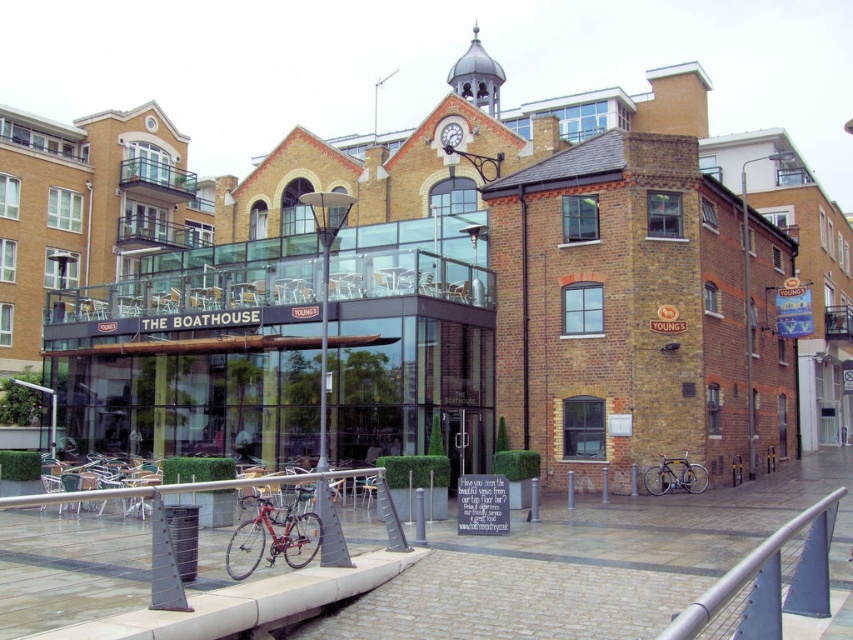
You are a GUI agent. You are given a task and a screenshot of the screen. Output one action in this format:
    pyautogui.click(x=<x>, y=<y>)
    Task: Click on the shiny red bicycle at lower left
    The width and height of the screenshot is (853, 640).
    Given the screenshot: What is the action you would take?
    pyautogui.click(x=273, y=538)

Identify the location of shiny red bicycle at lower left. (273, 538).

Measure the distance between polished metal railing at lower right and brushed metal rail at lower center.

polished metal railing at lower right is 18.48 meters from brushed metal rail at lower center.

Is polished metal railing at lower right wider than brushed metal rail at lower center?

Yes, polished metal railing at lower right is wider than brushed metal rail at lower center.

The width and height of the screenshot is (853, 640). In order to click on polished metal railing at lower right in this screenshot , I will do `click(741, 572)`.

Locate an element on the screen. The height and width of the screenshot is (640, 853). polished metal railing at lower right is located at coordinates (x=741, y=572).

Describe the element at coordinates (741, 572) in the screenshot. I see `polished metal railing at lower right` at that location.

Find the location of a particular element. This screenshot has width=853, height=640. polished metal railing at lower right is located at coordinates (741, 572).